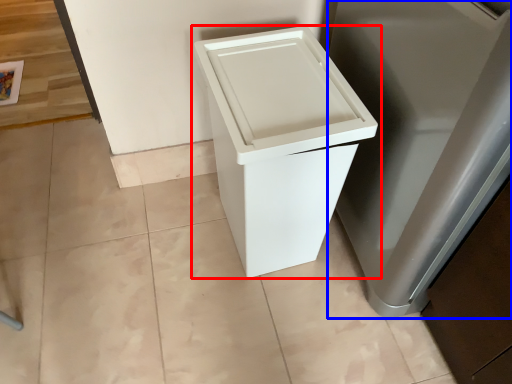
Question: Which object appears closest to the camera in this image, waste container (highlighted by a red box) or appliance (highlighted by a blue box)?

Choices:
 (A) waste container
 (B) appliance

Answer: (B)